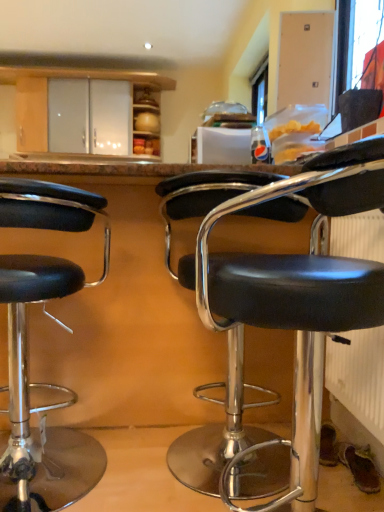
Question: From the image's perspective, would you say white textured radiator at lower right is positioned over black leather stool at left, arranged as the 2th chair when viewed from the right?

Choices:
 (A) yes
 (B) no

Answer: (A)

Question: Does white textured radiator at lower right have a greater width compared to black leather stool at left, which is the 1th chair in left-to-right order?

Choices:
 (A) yes
 (B) no

Answer: (B)

Question: Is the position of white textured radiator at lower right more distant than that of black leather stool at left, which is the 1th chair in left-to-right order?

Choices:
 (A) yes
 (B) no

Answer: (A)

Question: Is white textured radiator at lower right to the right of black leather stool at left, arranged as the 2th chair when viewed from the right, from the viewer's perspective?

Choices:
 (A) yes
 (B) no

Answer: (A)

Question: Is white textured radiator at lower right smaller than black leather stool at left, which is the 1th chair in left-to-right order?

Choices:
 (A) yes
 (B) no

Answer: (A)

Question: Would you say white textured radiator at lower right is to the left or to the right of black leather stool at center, placed as the 2th chair when sorted from left to right, in the picture?

Choices:
 (A) right
 (B) left

Answer: (A)

Question: Is white textured radiator at lower right taller or shorter than black leather stool at center, placed as the 2th chair when sorted from left to right?

Choices:
 (A) tall
 (B) short

Answer: (B)

Question: Would you say white textured radiator at lower right is inside or outside black leather stool at center, the 1th chair viewed from the right?

Choices:
 (A) inside
 (B) outside

Answer: (B)

Question: Based on their sizes in the image, would you say white textured radiator at lower right is bigger or smaller than black leather stool at center, the 1th chair viewed from the right?

Choices:
 (A) small
 (B) big

Answer: (A)

Question: From the image's perspective, relative to black leather stool at left, which is the 1th chair in left-to-right order, is white textured radiator at lower right above or below?

Choices:
 (A) above
 (B) below

Answer: (A)

Question: Considering the positions of white textured radiator at lower right and black leather stool at left, which is the 1th chair in left-to-right order, in the image, is white textured radiator at lower right wider or thinner than black leather stool at left, which is the 1th chair in left-to-right order,?

Choices:
 (A) thin
 (B) wide

Answer: (A)

Question: Considering the positions of point pos(354,386) and point pos(52,220), is point pos(354,386) closer or farther from the camera than point pos(52,220)?

Choices:
 (A) closer
 (B) farther

Answer: (B)

Question: From a real-world perspective, relative to black leather stool at left, which is the 1th chair in left-to-right order, is white textured radiator at lower right vertically above or below?

Choices:
 (A) below
 (B) above

Answer: (B)

Question: From the image's perspective, is black leather stool at left, arranged as the 2th chair when viewed from the right, located above or below white textured radiator at lower right?

Choices:
 (A) below
 (B) above

Answer: (A)

Question: From their relative heights in the image, would you say black leather stool at left, arranged as the 2th chair when viewed from the right, is taller or shorter than white textured radiator at lower right?

Choices:
 (A) short
 (B) tall

Answer: (B)